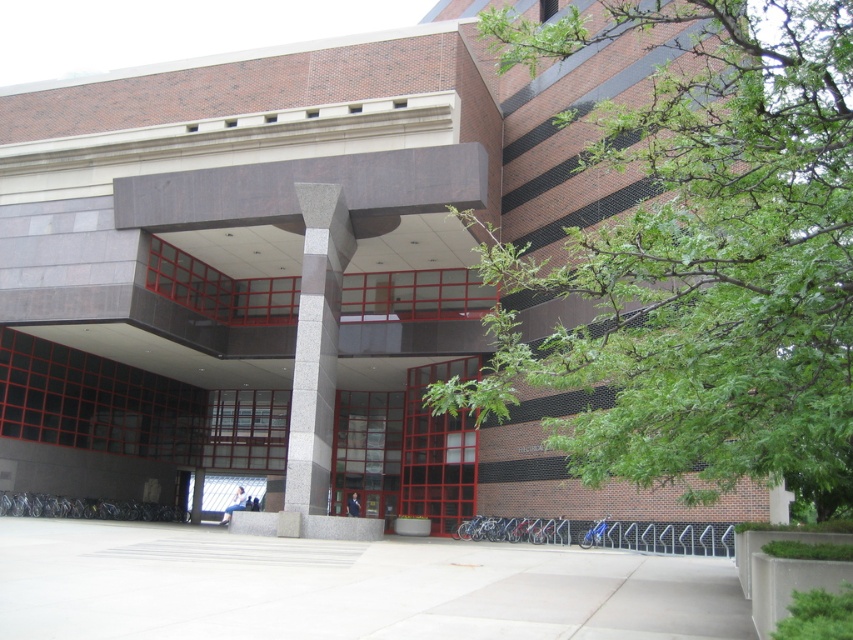
You are a city planner assessing the space between the green leafy tree at upper right and the granite column at center. If you want to install a bench that is 2 meters wide, will there be enough space between them?

The green leafy tree at upper right is wider than the granite column at center. However, the exact distance between them isn not specified in the provided information. Without knowing the actual spacing, it is impossible to determine if the 2 meter bench will fit.

You are a delivery person trying to park your 1.2 meter wide delivery cart in the plaza in front of the building. There is a space between the green leafy tree at upper right and the red glass door at center. Can your cart fit there?

The space between the green leafy tree at upper right and the red glass door at center is wider than 1.2 meters since the tree is wider than the door, so the cart can fit there.